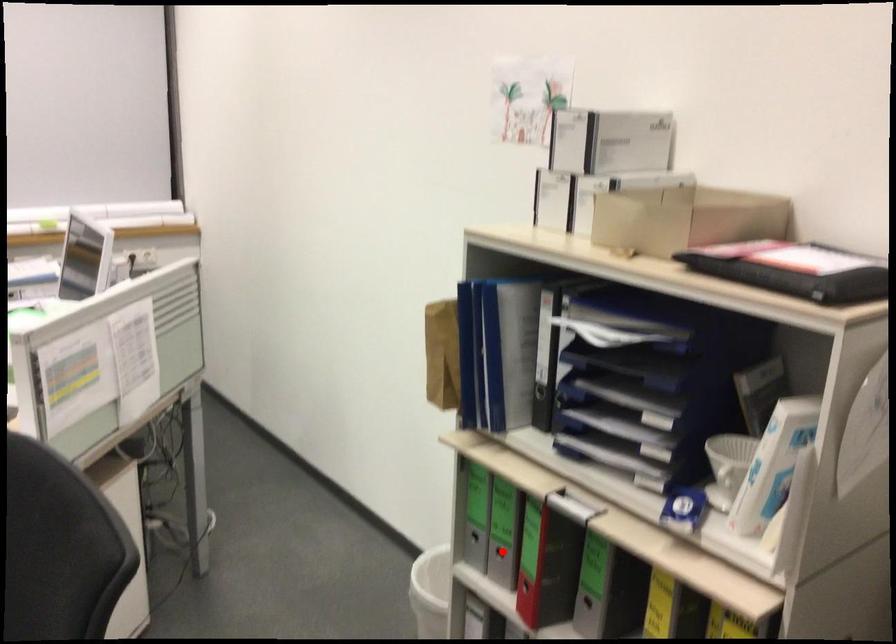
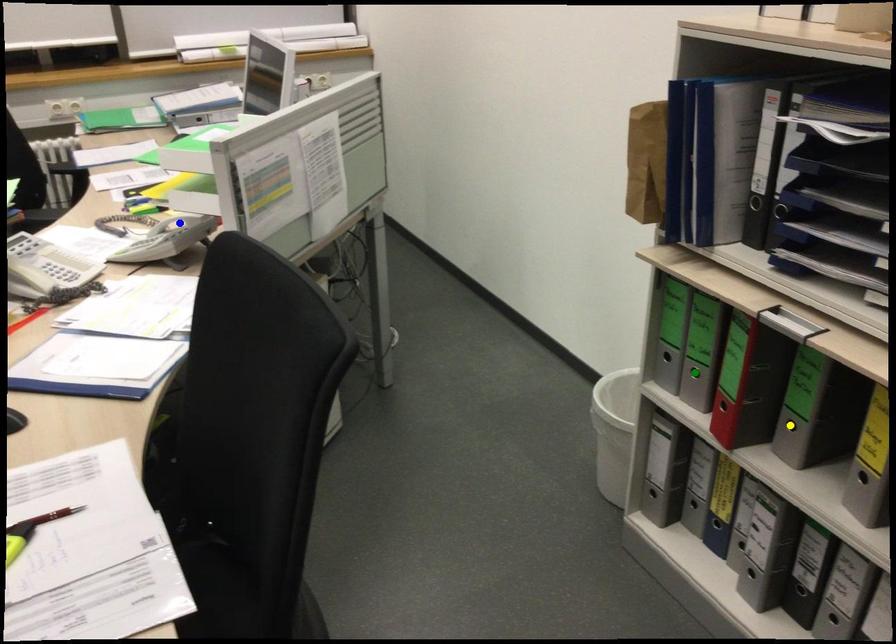
Question: I am providing you with two images of the same scene from different viewpoints. A red point is marked on the first image. You are given multiple points on the second image. Which mark in image 2 goes with the point in image 1?

Choices:
 (A) green point
 (B) yellow point
 (C) blue point

Answer: (A)